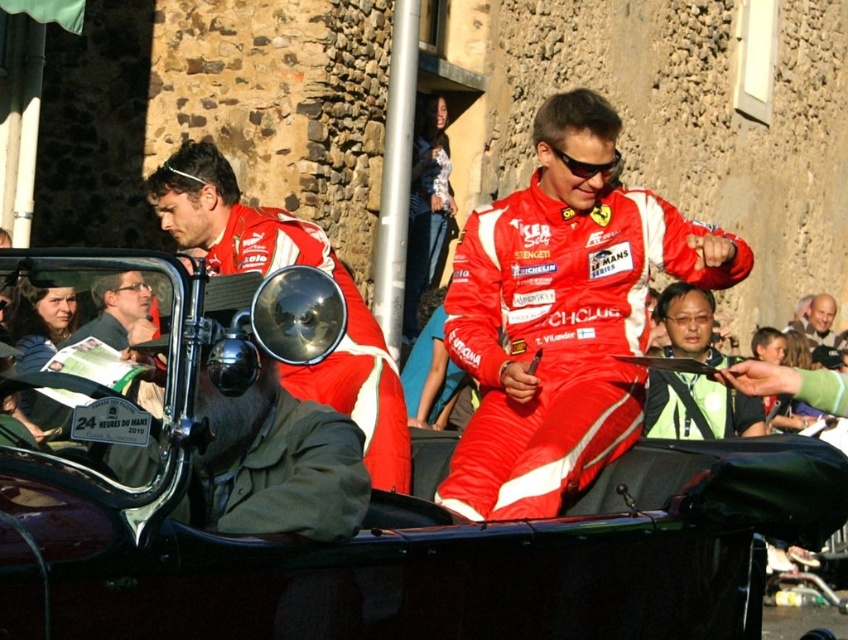
You are a photographer at the vintage car event. You need to position yourself to capture both the matte red racing suit at left and the matte black jacket at left in the same frame. Which object should you focus on first to ensure both are in the frame?

The matte black jacket at left is to the left of the matte red racing suit at left. To capture both in the same frame, focus on the matte black jacket at left first since it is positioned further to the left, allowing the camera to include both objects by adjusting the frame to the right.

You are a photographer at the vintage car event. You need to position yourself so that both the red fabric suit at center and the matte red racing suit at left are in your camera frame. Given their height difference, which one will appear larger in the photo?

The red fabric suit at center will appear larger in the photo because it is much taller than the matte red racing suit at left.